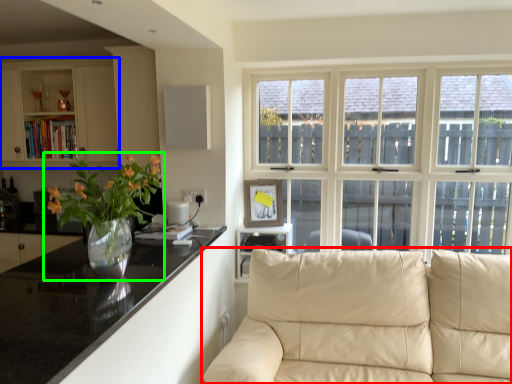
Question: Which object is the closest to the studio couch (highlighted by a red box)? Choose among these: cabinetry (highlighted by a blue box) or houseplant (highlighted by a green box).

Choices:
 (A) cabinetry
 (B) houseplant

Answer: (B)